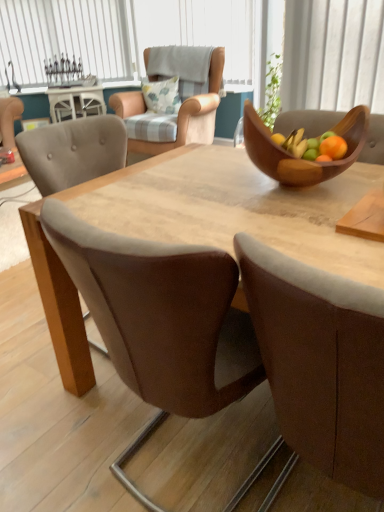
Where is `free region under wooden bowl at center (from a real-world perspective)`? The image size is (384, 512). free region under wooden bowl at center (from a real-world perspective) is located at coordinates (307, 190).